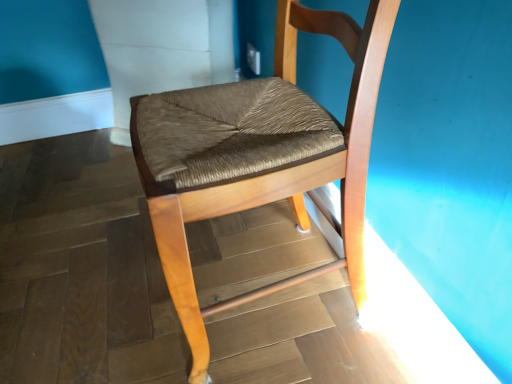
This screenshot has width=512, height=384. I want to click on wooden chair with woven seat cushion at center, so click(260, 156).

The width and height of the screenshot is (512, 384). Describe the element at coordinates (260, 156) in the screenshot. I see `wooden chair with woven seat cushion at center` at that location.

The height and width of the screenshot is (384, 512). In order to click on wooden chair with woven seat cushion at center in this screenshot , I will do `click(260, 156)`.